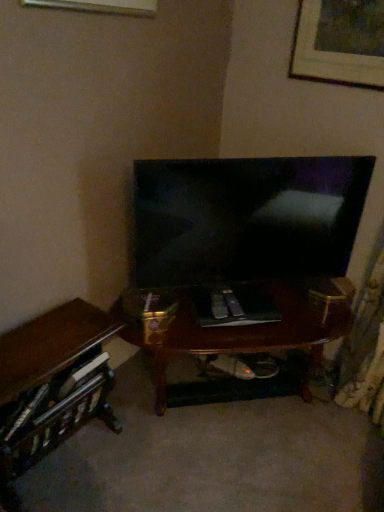
Describe the element at coordinates (51, 386) in the screenshot. I see `wooden desk at lower left` at that location.

What do you see at coordinates (340, 42) in the screenshot?
I see `wooden picture frame at upper right` at bounding box center [340, 42].

Where is `matte black tv at center`? The height and width of the screenshot is (512, 384). matte black tv at center is located at coordinates (246, 217).

Does matte black tv at center lie behind wooden desk at lower left?

That is True.

Identify the location of desk on the left side of matte black tv at center. (51, 386).

From the image's perspective, between matte black tv at center and wooden desk at lower left, who is located below?

wooden desk at lower left is shown below in the image.

Is matte black tv at center looking in the opposite direction of wooden desk at lower left?

Result: matte black tv at center is not turned away from wooden desk at lower left.

Is point (83, 346) in front of point (375, 87)?

Yes, it is.

Based on the photo, which of these two, wooden desk at lower left or wooden picture frame at upper right, stands taller?

wooden desk at lower left is taller.

Based on their sizes in the image, would you say wooden desk at lower left is bigger or smaller than wooden picture frame at upper right?

Clearly, wooden desk at lower left is larger in size than wooden picture frame at upper right.

Is point (88, 345) positioned before point (332, 238)?

Yes, it is in front of point (332, 238).

Between wooden desk at lower left and matte black tv at center, which one has less height?

wooden desk at lower left is shorter.

Is wooden desk at lower left far from matte black tv at center?

No, wooden desk at lower left is in close proximity to matte black tv at center.

From the image's perspective, between wooden desk at lower left and matte black tv at center, who is located below?

wooden desk at lower left.

In the scene shown: Is wooden picture frame at upper right at the right side of matte black tv at center?

Correct, you'll find wooden picture frame at upper right to the right of matte black tv at center.

From a real-world perspective, is wooden picture frame at upper right physically above matte black tv at center?

Yes, from a real-world perspective, wooden picture frame at upper right is above matte black tv at center.

From the image's perspective, which is above, wooden picture frame at upper right or matte black tv at center?

wooden picture frame at upper right.

Could you tell me if wooden picture frame at upper right is facing wooden desk at lower left?

No, wooden picture frame at upper right does not turn towards wooden desk at lower left.

Does wooden picture frame at upper right have a lesser height compared to wooden desk at lower left?

Yes, wooden picture frame at upper right is shorter than wooden desk at lower left.

Considering the relative positions of wooden picture frame at upper right and wooden desk at lower left in the image provided, is wooden picture frame at upper right to the right of wooden desk at lower left from the viewer's perspective?

Yes.

From a real-world perspective, between wooden picture frame at upper right and wooden desk at lower left, who is vertically higher?

In real-world perspective, wooden picture frame at upper right is above.

Is matte black tv at center aimed at wooden picture frame at upper right?

No, matte black tv at center is not turned towards wooden picture frame at upper right.

Which is closer to the camera, [151,284] or [349,40]?

The point [349,40] is closer to the camera.

Considering the sizes of objects matte black tv at center and wooden picture frame at upper right in the image provided, who is thinner, matte black tv at center or wooden picture frame at upper right?

With smaller width is wooden picture frame at upper right.

Considering the positions of objects matte black tv at center and wooden picture frame at upper right in the image provided, who is more to the left, matte black tv at center or wooden picture frame at upper right?

matte black tv at center is more to the left.

Identify the location of television on the right side of wooden desk at lower left. (246, 217).

I want to click on desk below the wooden picture frame at upper right (from a real-world perspective), so click(51, 386).

From the image, which object appears to be farther from matte black tv at center, wooden desk at lower left or wooden picture frame at upper right?

wooden desk at lower left is further to matte black tv at center.

Consider the image. Considering their positions, is wooden picture frame at upper right positioned closer to wooden desk at lower left than matte black tv at center?

matte black tv at center is positioned closer to the anchor wooden desk at lower left.

Which object lies further to the anchor point wooden picture frame at upper right, wooden desk at lower left or matte black tv at center?

wooden desk at lower left lies further to wooden picture frame at upper right than the other object.

Based on their spatial positions, is matte black tv at center or wooden picture frame at upper right further from wooden desk at lower left?

wooden picture frame at upper right.

Considering their positions, is matte black tv at center positioned further to wooden picture frame at upper right than wooden desk at lower left?

wooden desk at lower left lies further to wooden picture frame at upper right than the other object.

Which object lies further to the anchor point matte black tv at center, wooden picture frame at upper right or wooden desk at lower left?

The object further to matte black tv at center is wooden desk at lower left.

Identify the location of television between wooden picture frame at upper right and wooden desk at lower left in the vertical direction. Image resolution: width=384 pixels, height=512 pixels. (246, 217).